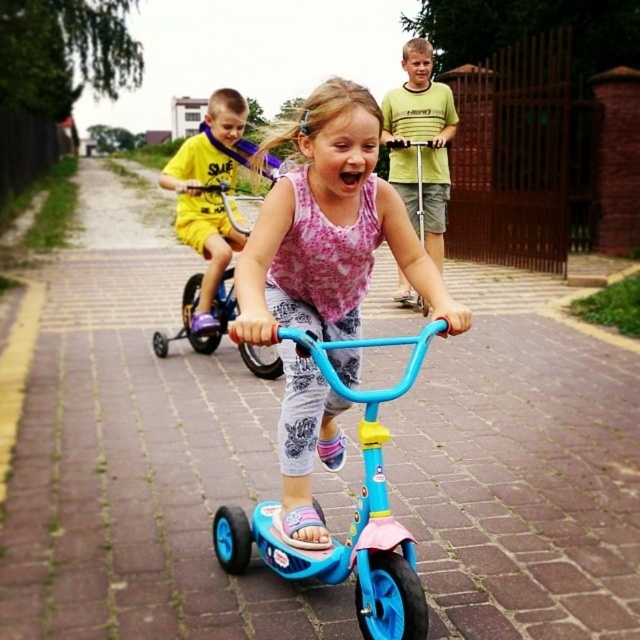
You are a photographer trying to capture a photo of the yellow matte shirt at upper left and the blue plastic scooter at center. Which object should you zoom in on to make them appear the same size in the photo?

The yellow matte shirt at upper left has a smaller size compared to the blue plastic scooter at center, so you should zoom in on the yellow matte shirt at upper left to make them appear the same size in the photo.

You are standing in the scene and want to place a small bench between the two points, point [214,113] and point [419,304]. Which point should the bench be closer to so that it is nearer to the viewer?

The bench should be placed closer to point [214,113] because it is closer to the viewer than point [419,304].